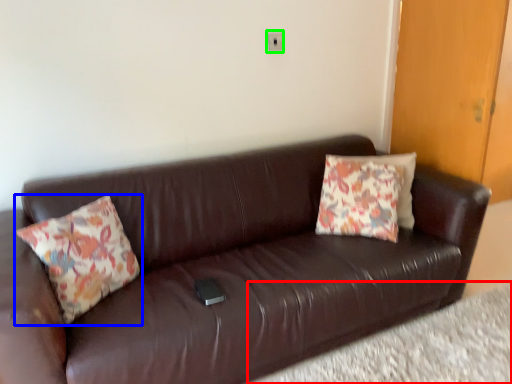
Question: Based on their relative distances, which object is farther from plain (highlighted by a red box)? Choose from pillow (highlighted by a blue box) and electric outlet (highlighted by a green box).

Choices:
 (A) pillow
 (B) electric outlet

Answer: (B)